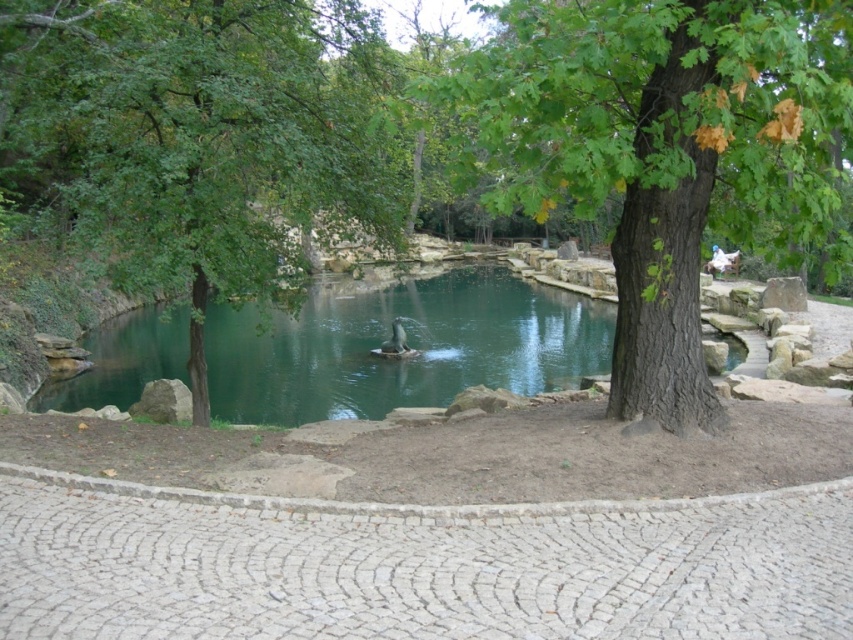
Is green smooth water at center below brown fuzzy duck at center?

No.

Who is positioned more to the right, green smooth water at center or brown fuzzy duck at center?

From the viewer's perspective, brown fuzzy duck at center appears more on the right side.

Does point (288, 372) lie in front of point (393, 346)?

Yes, it is in front of point (393, 346).

This screenshot has width=853, height=640. In order to click on green smooth water at center in this screenshot , I will do `click(409, 344)`.

Based on the photo, can you confirm if green leafy tree at center is positioned above brown fuzzy duck at center?

Yes, green leafy tree at center is above brown fuzzy duck at center.

Does green leafy tree at center come behind brown fuzzy duck at center?

That is False.

Is point (236, 65) in front of point (398, 321)?

Yes, it is in front of point (398, 321).

Locate an element on the screen. green leafy tree at center is located at coordinates (196, 134).

Which of these two, green rough bark tree at center or green smooth water at center, stands taller?

green rough bark tree at center is taller.

Measure the distance from green rough bark tree at center to green smooth water at center.

green rough bark tree at center and green smooth water at center are 25.41 feet apart from each other.

Image resolution: width=853 pixels, height=640 pixels. I want to click on green rough bark tree at center, so click(660, 148).

You are a GUI agent. You are given a task and a screenshot of the screen. Output one action in this format:
    pyautogui.click(x=<x>, y=<y>)
    Task: Click on the green rough bark tree at center
    This screenshot has height=640, width=853.
    Given the screenshot: What is the action you would take?
    pyautogui.click(x=660, y=148)